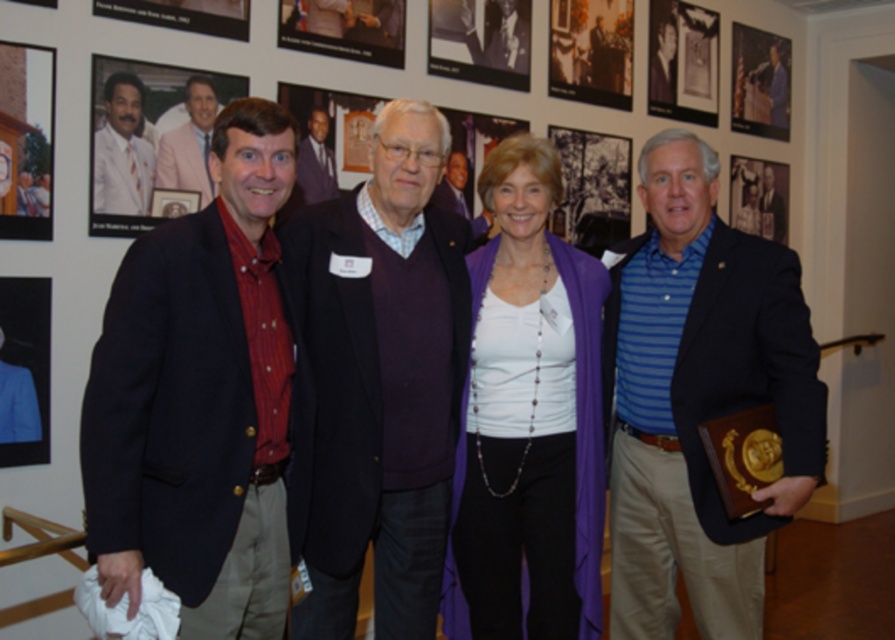
You are organizing a clothing donation drive and need to categorize items by type. Looking at the image, which of the following is a sweater and which is a fabric? The items are the purple sweater at center and the purple fabric at center. Based on their positions, can you determine which one is on the left?

The purple sweater at center is positioned on the left side of the purple fabric at center, so the purple sweater at center is the one on the left.